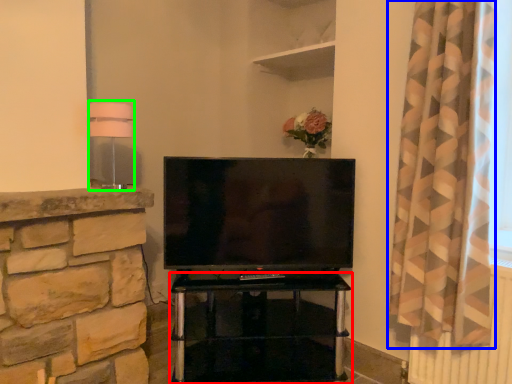
Question: Considering the real-world distances, which object is farthest from furniture (highlighted by a red box)? curtain (highlighted by a blue box) or lamp (highlighted by a green box)?

Choices:
 (A) curtain
 (B) lamp

Answer: (B)